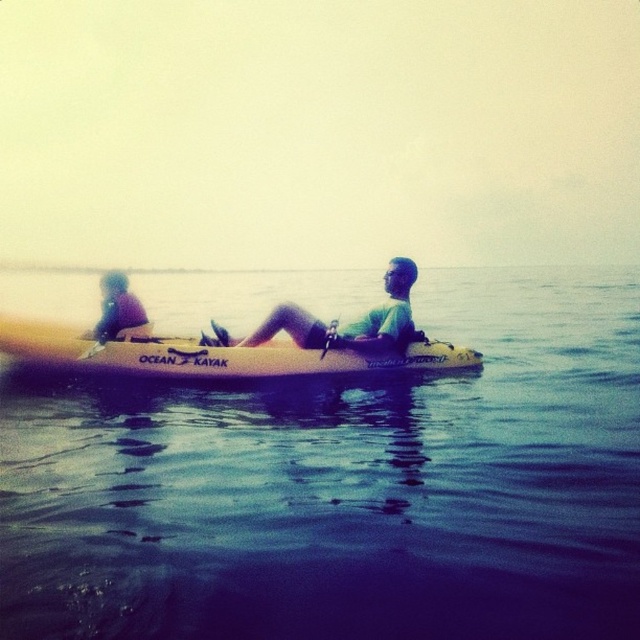
Consider the image. Who is shorter, yellow matte kayak at center or yellow foam paddle at center?

yellow foam paddle at center is shorter.

Is yellow matte kayak at center positioned behind yellow foam paddle at center?

No, yellow matte kayak at center is closer to the viewer.

The width and height of the screenshot is (640, 640). Describe the element at coordinates (212, 355) in the screenshot. I see `yellow matte kayak at center` at that location.

In order to click on yellow matte kayak at center in this screenshot , I will do `click(212, 355)`.

Is blue water at center to the right of yellow matte kayak at center from the viewer's perspective?

Yes, blue water at center is to the right of yellow matte kayak at center.

Between point (356, 508) and point (336, 371), which one is positioned behind?

The point (336, 371) is more distant.

Who is more forward, [182,420] or [164,348]?

Point [164,348] is more forward.

Locate an element on the screen. blue water at center is located at coordinates 344,486.

Is blue water at center smaller than yellow foam paddle at center?

Actually, blue water at center might be larger than yellow foam paddle at center.

Which is below, blue water at center or yellow foam paddle at center?

yellow foam paddle at center

Which is in front, point (557, 502) or point (328, 346)?

Point (557, 502) is more forward.

The width and height of the screenshot is (640, 640). Identify the location of blue water at center. (344, 486).